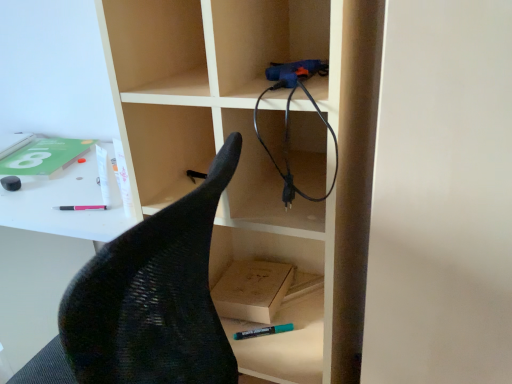
The height and width of the screenshot is (384, 512). Find the location of `vacant space to the right of matte black eraser at left, which is the second stationery in front-to-back order`. vacant space to the right of matte black eraser at left, which is the second stationery in front-to-back order is located at coordinates (59, 186).